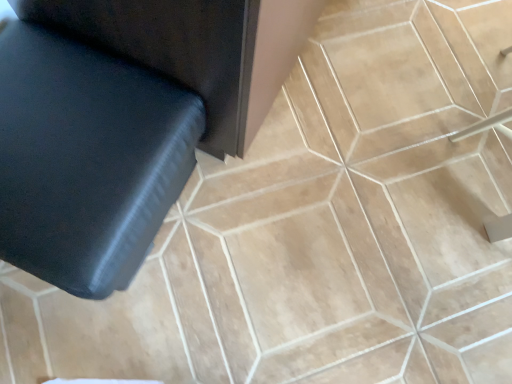
Where is `matte black ottoman at lower left`? This screenshot has width=512, height=384. matte black ottoman at lower left is located at coordinates (125, 120).

What do you see at coordinates (125, 120) in the screenshot? This screenshot has width=512, height=384. I see `matte black ottoman at lower left` at bounding box center [125, 120].

Locate an element on the screen. Image resolution: width=512 pixels, height=384 pixels. matte black ottoman at lower left is located at coordinates (125, 120).